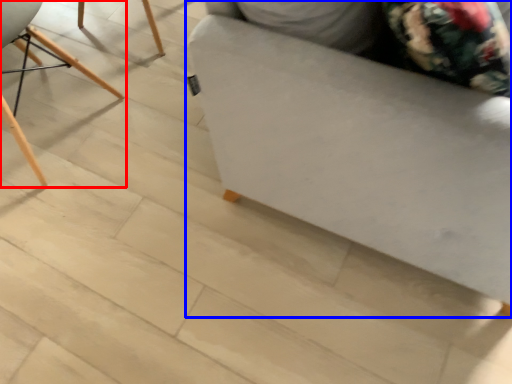
Question: Which of the following is the closest to the observer, chair (highlighted by a red box) or furniture (highlighted by a blue box)?

Choices:
 (A) chair
 (B) furniture

Answer: (B)